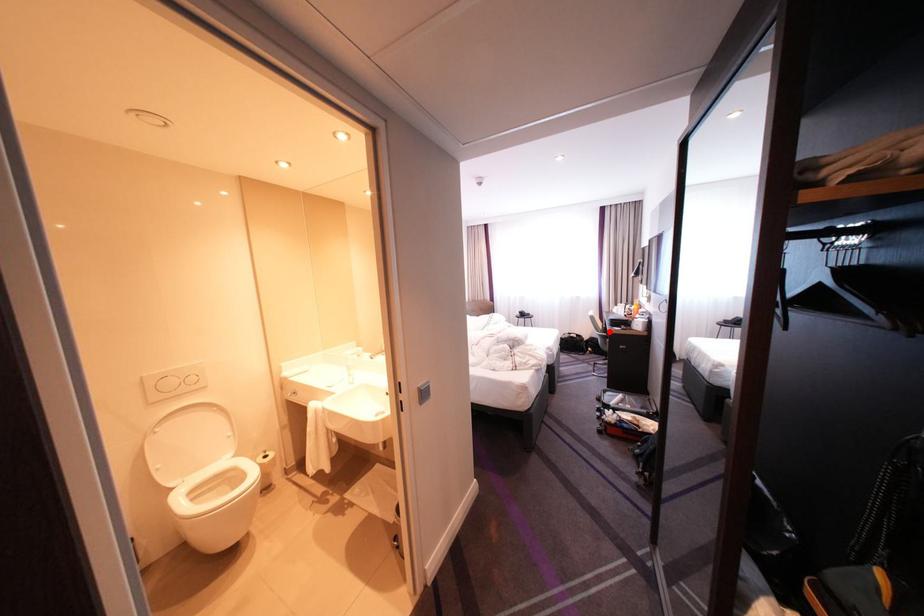
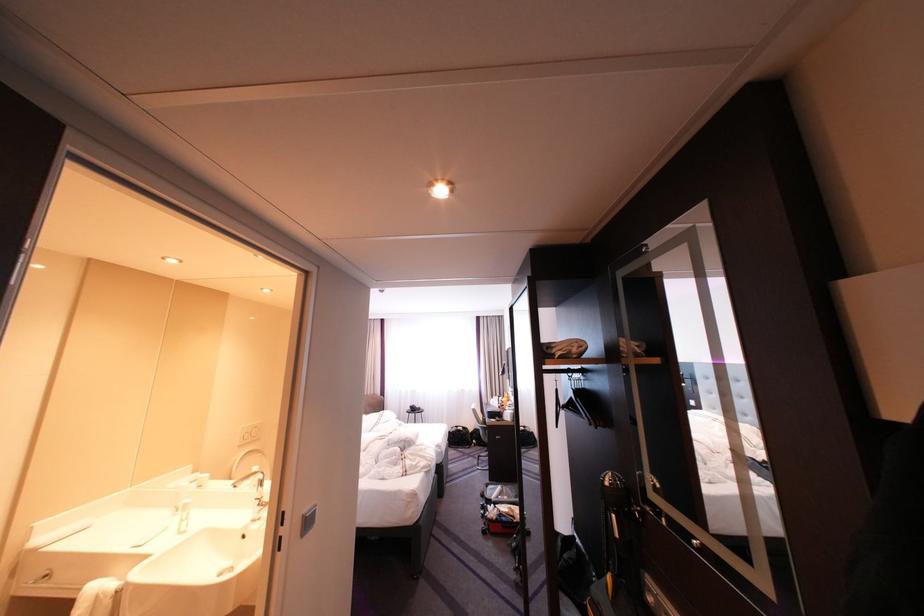
Question: I am providing you with two images of the same scene from different viewpoints. Image1 has a red point marked. In image2, the corresponding 3D location appears at what relative position? Reply with the corresponding letter.

Choices:
 (A) Closer
 (B) Farther

Answer: (B)